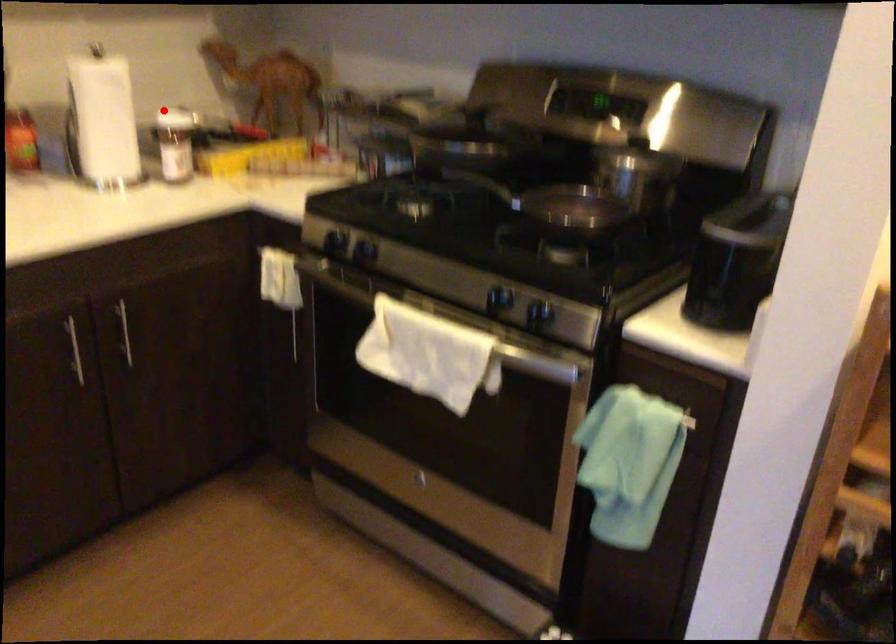
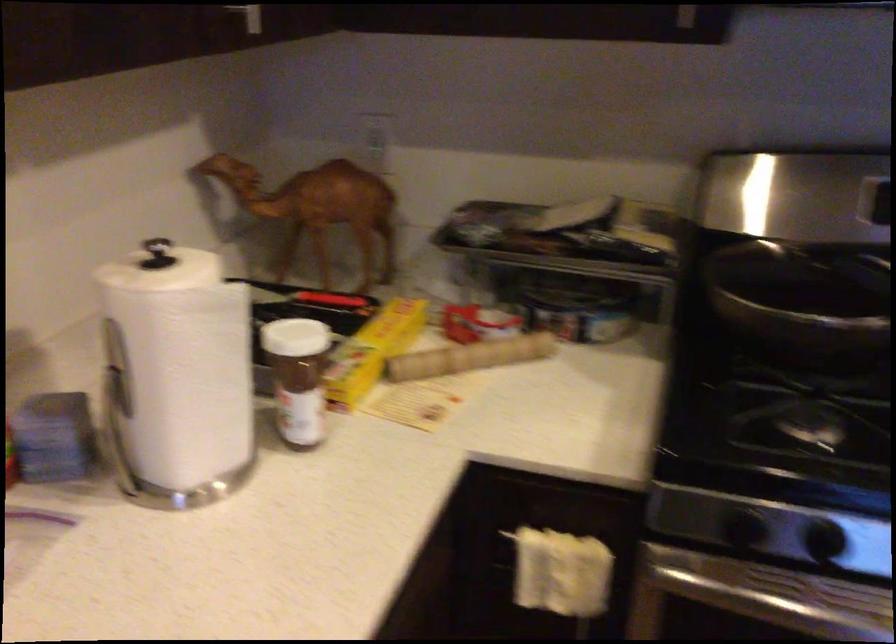
Locate, in the second image, the point that corresponds to the highlighted location in the first image.

(289, 337)